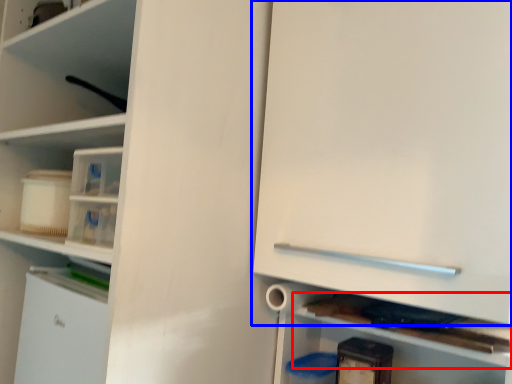
Question: Which point is further to the camera, cabinet (highlighted by a red box) or cabinetry (highlighted by a blue box)?

Choices:
 (A) cabinet
 (B) cabinetry

Answer: (A)